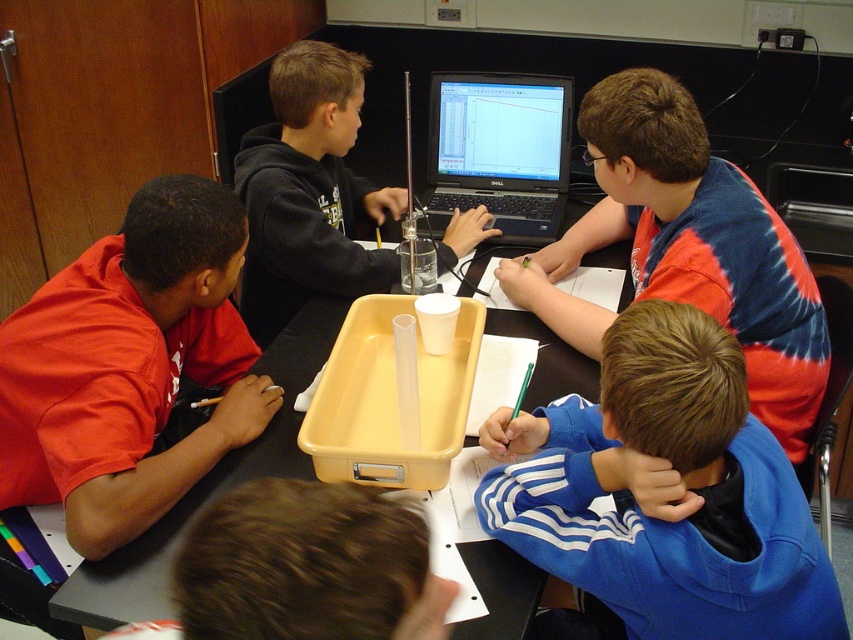
Which object is located at the coordinates point [129,365]?

The point [129,365] is on the matte red shirt at left.

You are a teacher observing the classroom scene. You notice the matte red shirt at left and the black plastic laptop at center. Which object is positioned further to the left in the image?

The matte red shirt at left is positioned further to the left than the black plastic laptop at center.

You are observing a classroom scene. There is a matte red shirt at left and a black plastic laptop at center. From the perspective of someone standing in front of the classroom, which object is positioned lower?

The matte red shirt at left is below the black plastic laptop at center, so it is positioned lower.